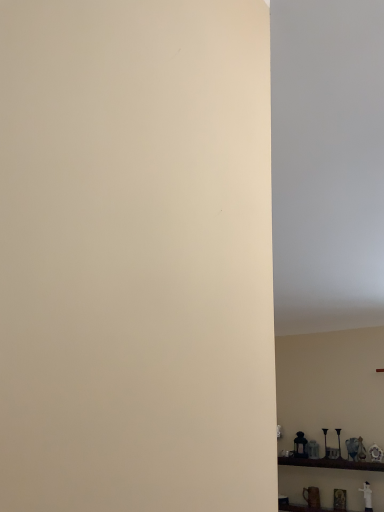
At what (x,y) coordinates should I click in order to perform the action: click on wooden shelf at lower right. Please return your answer as a coordinate pair (x, y). Looking at the image, I should click on (330, 463).

What is the approximate width of wooden shelf at lower right?

The width of wooden shelf at lower right is 8.59 inches.

Describe the element at coordinates (330, 463) in the screenshot. I see `wooden shelf at lower right` at that location.

This screenshot has width=384, height=512. In order to click on wooden shelf at lower right in this screenshot , I will do `click(330, 463)`.